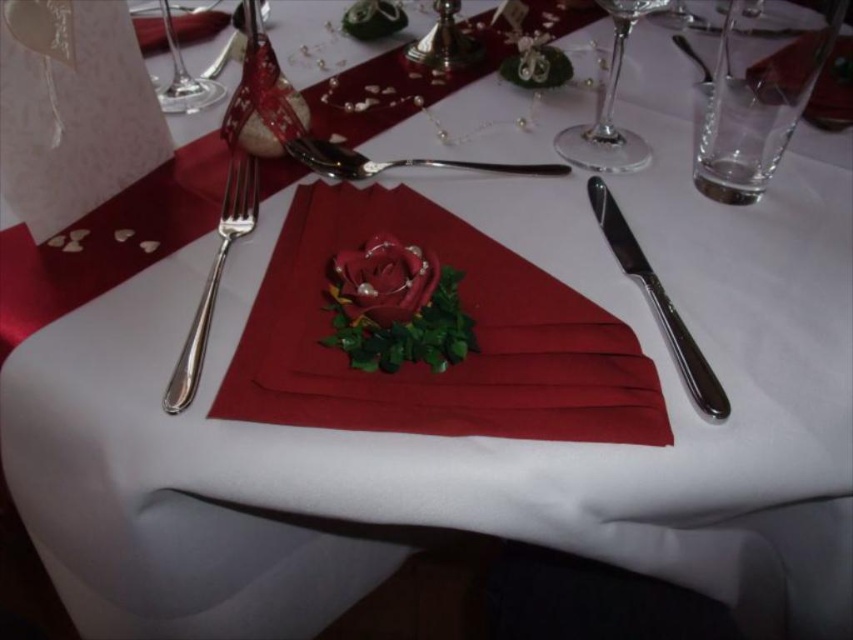
What are the coordinates of `burgundy satin napkin at center` in the screenshot? It's located at (424, 364).

Does burgundy satin napkin at center have a smaller size compared to polished metal spoon at center?

Actually, burgundy satin napkin at center might be larger than polished metal spoon at center.

Is point (326, 237) positioned behind point (305, 140)?

No, it is not.

This screenshot has width=853, height=640. Identify the location of burgundy satin napkin at center. (424, 364).

Does transparent glass wine glass at upper right lie behind polished metal spoon at center?

That is False.

Looking at this image, can you confirm if transparent glass wine glass at upper right is thinner than polished metal spoon at center?

Yes, transparent glass wine glass at upper right is thinner than polished metal spoon at center.

Measure the distance between transparent glass wine glass at upper right and camera.

transparent glass wine glass at upper right is 19.57 inches away from camera.

This screenshot has width=853, height=640. I want to click on transparent glass wine glass at upper right, so click(608, 106).

Can you confirm if transparent glass wine glass at upper right is thinner than transparent glass wine glass at upper left?

Incorrect, transparent glass wine glass at upper right's width is not less than transparent glass wine glass at upper left's.

Can you confirm if transparent glass wine glass at upper right is positioned to the right of transparent glass wine glass at upper left?

Yes, transparent glass wine glass at upper right is to the right of transparent glass wine glass at upper left.

Locate an element on the screen. The image size is (853, 640). transparent glass wine glass at upper right is located at coordinates (608, 106).